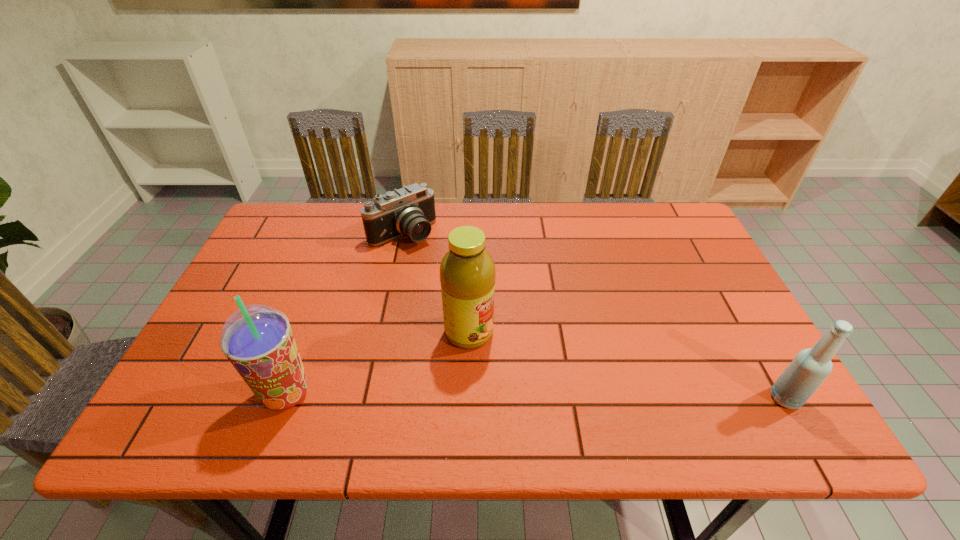
Locate an element on the screen. The image size is (960, 540). vacant space located on the front label of the third nearest object is located at coordinates (555, 385).

Identify the location of blank area located on the front label of the third nearest object. Image resolution: width=960 pixels, height=540 pixels. (559, 388).

The height and width of the screenshot is (540, 960). In order to click on vacant space situated 0.200m on the front-facing side of the farthest object in this screenshot , I will do `click(457, 286)`.

This screenshot has height=540, width=960. Identify the location of vacant space situated 0.210m on the front-facing side of the farthest object. (459, 288).

Find the location of `vacant space located 0.340m on the front-facing side of the farthest object`. vacant space located 0.340m on the front-facing side of the farthest object is located at coordinates (489, 317).

The width and height of the screenshot is (960, 540). I want to click on object that is positioned at the far edge, so [x=409, y=211].

The width and height of the screenshot is (960, 540). I want to click on smoothie that is at the near edge, so click(257, 339).

Identify the location of bottle situated at the near edge. (810, 367).

Where is `object located in the right edge section of the desktop`? Image resolution: width=960 pixels, height=540 pixels. object located in the right edge section of the desktop is located at coordinates (810, 367).

This screenshot has height=540, width=960. In order to click on object that is at the near right corner in this screenshot , I will do `click(810, 367)`.